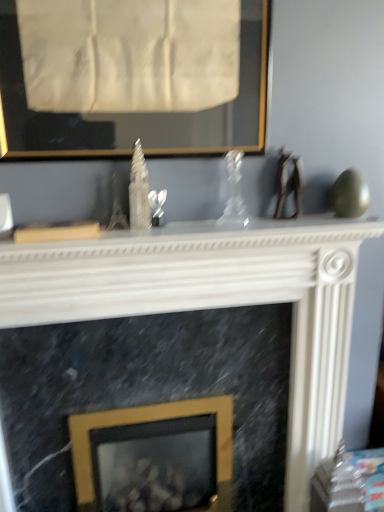
Question: Is gold metallic picture frame at center, marked as the first picture frame in a back-to-front arrangement, located outside transparent glass vase at center?

Choices:
 (A) no
 (B) yes

Answer: (B)

Question: Is gold metallic picture frame at center, marked as the second picture frame in a front-to-back arrangement, not close to transparent glass vase at center?

Choices:
 (A) no
 (B) yes

Answer: (A)

Question: From the image's perspective, is gold metallic picture frame at center, marked as the first picture frame in a back-to-front arrangement, beneath transparent glass vase at center?

Choices:
 (A) yes
 (B) no

Answer: (A)

Question: Can you confirm if gold metallic picture frame at center, marked as the second picture frame in a front-to-back arrangement, is shorter than transparent glass vase at center?

Choices:
 (A) no
 (B) yes

Answer: (A)

Question: Does gold metallic picture frame at center, the second picture frame positioned from the top, turn towards transparent glass vase at center?

Choices:
 (A) yes
 (B) no

Answer: (B)

Question: Can you confirm if gold metallic picture frame at center, marked as the second picture frame in a front-to-back arrangement, is taller than transparent glass vase at center?

Choices:
 (A) yes
 (B) no

Answer: (A)

Question: Is the depth of gold-framed picture at upper center, the second picture frame from the bottom, less than that of gold metallic picture frame at center, the 1th picture frame ordered from the bottom?

Choices:
 (A) no
 (B) yes

Answer: (B)

Question: From the image's perspective, is gold-framed picture at upper center, which ranks as the 2th picture frame in back-to-front order, under gold metallic picture frame at center, marked as the second picture frame in a front-to-back arrangement?

Choices:
 (A) no
 (B) yes

Answer: (A)

Question: Is gold-framed picture at upper center, the 1th picture frame when ordered from top to bottom, next to gold metallic picture frame at center, marked as the first picture frame in a back-to-front arrangement?

Choices:
 (A) yes
 (B) no

Answer: (B)

Question: Could you tell me if gold-framed picture at upper center, which ranks as the 2th picture frame in back-to-front order, is turned towards gold metallic picture frame at center, the second picture frame positioned from the top?

Choices:
 (A) yes
 (B) no

Answer: (B)

Question: From a real-world perspective, is gold-framed picture at upper center, which ranks as the 2th picture frame in back-to-front order, physically below gold metallic picture frame at center, marked as the second picture frame in a front-to-back arrangement?

Choices:
 (A) no
 (B) yes

Answer: (A)

Question: Considering the relative sizes of gold-framed picture at upper center, the 1th picture frame when ordered from top to bottom, and gold metallic picture frame at center, marked as the first picture frame in a back-to-front arrangement, in the image provided, is gold-framed picture at upper center, the 1th picture frame when ordered from top to bottom, bigger than gold metallic picture frame at center, marked as the first picture frame in a back-to-front arrangement,?

Choices:
 (A) yes
 (B) no

Answer: (B)

Question: Considering the relative sizes of gold-framed picture at upper center, which is the first picture frame in front-to-back order, and transparent glass vase at center in the image provided, is gold-framed picture at upper center, which is the first picture frame in front-to-back order, bigger than transparent glass vase at center?

Choices:
 (A) no
 (B) yes

Answer: (B)